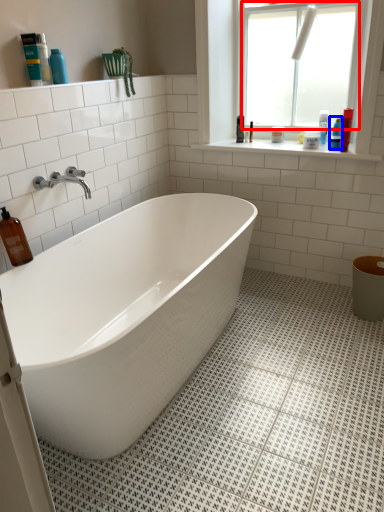
Question: Among these objects, which one is nearest to the camera, window screen (highlighted by a red box) or toiletry (highlighted by a blue box)?

Choices:
 (A) window screen
 (B) toiletry

Answer: (A)